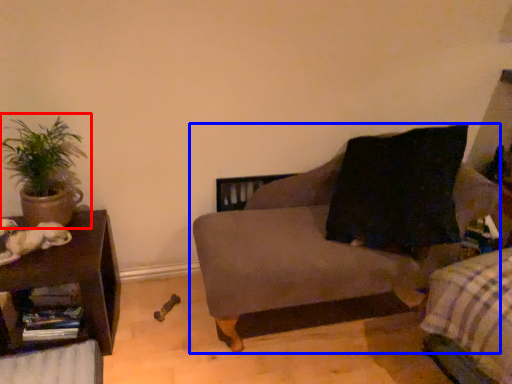
Question: Which object is closer to the camera taking this photo, houseplant (highlighted by a red box) or studio couch (highlighted by a blue box)?

Choices:
 (A) houseplant
 (B) studio couch

Answer: (B)